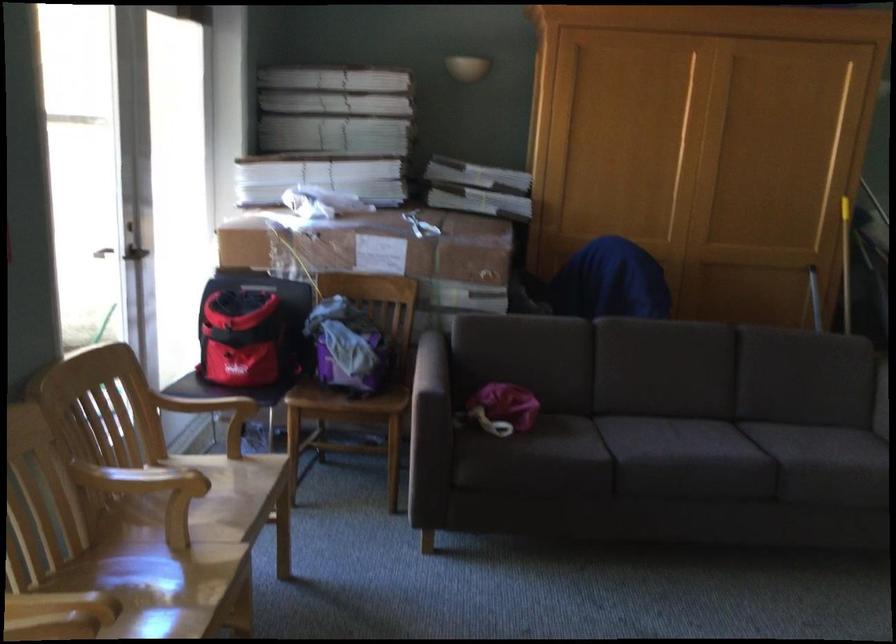
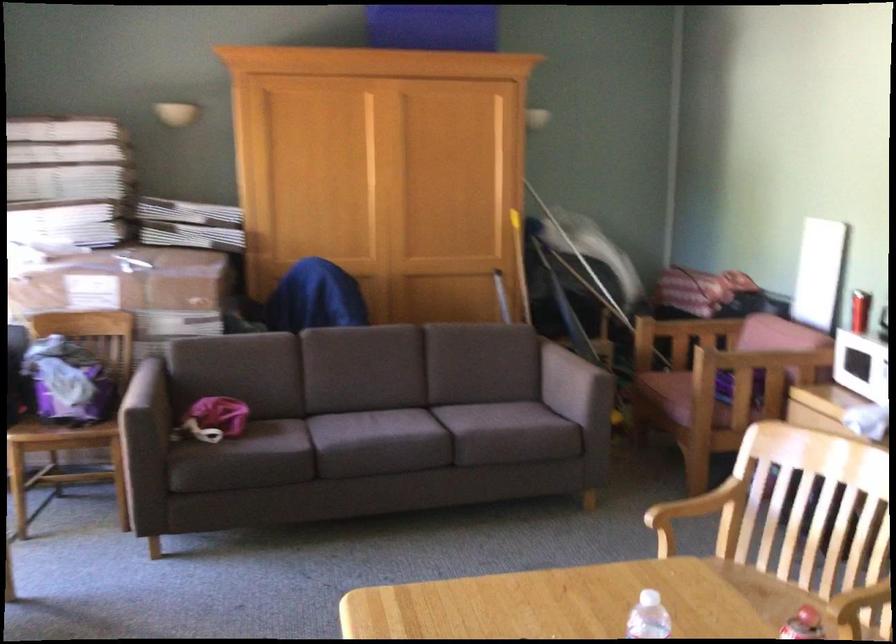
The point at (812, 464) is marked in the first image. Where is the corresponding point in the second image?

(467, 430)